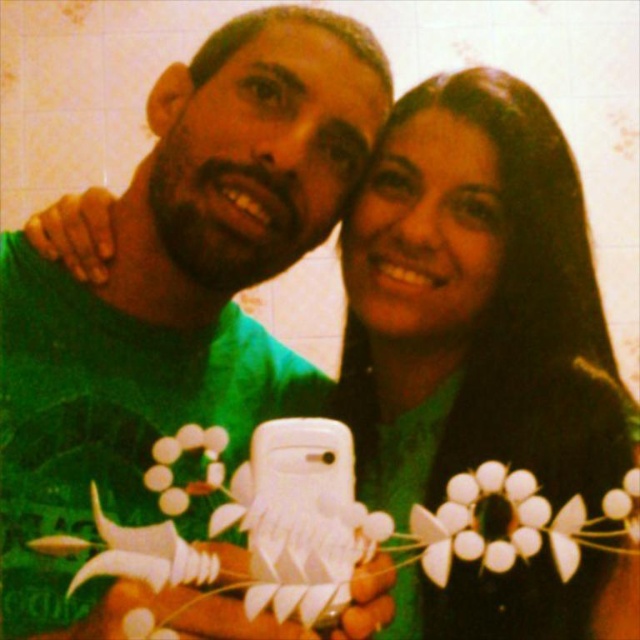
Looking at this image, you are a photographer trying to adjust the lighting for a photo shoot. You notice two decorative items at the center of the scene, the green matte necklace at center and the white paper flower at center. Which item is positioned higher up in the frame?

The green matte necklace at center is located above the white paper flower at center, so it is positioned higher up in the frame.

From the picture: You are a photographer holding a camera. You want to ensure that the green matte shirt at center is in focus while taking a portrait. Based on the scene, what is the minimum focusing distance you should set on your camera?

The minimum focusing distance should be set to at least 18.65 inches to ensure the green matte shirt at center is in focus, as it is 18.65 inches away from the camera.